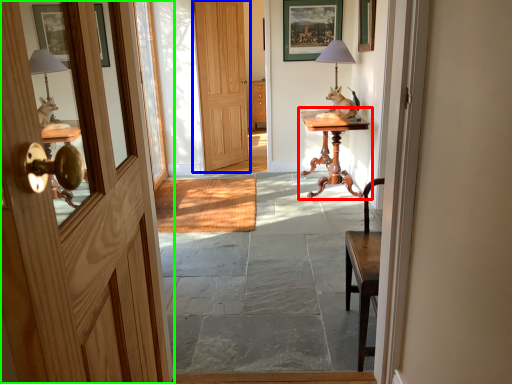
Question: Based on their relative distances, which object is nearer to table (highlighted by a red box)? Choose from door (highlighted by a blue box) and door (highlighted by a green box).

Choices:
 (A) door
 (B) door

Answer: (A)